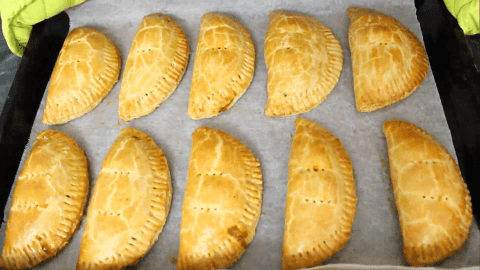
Where is `sheet`? sheet is located at coordinates (383, 155).